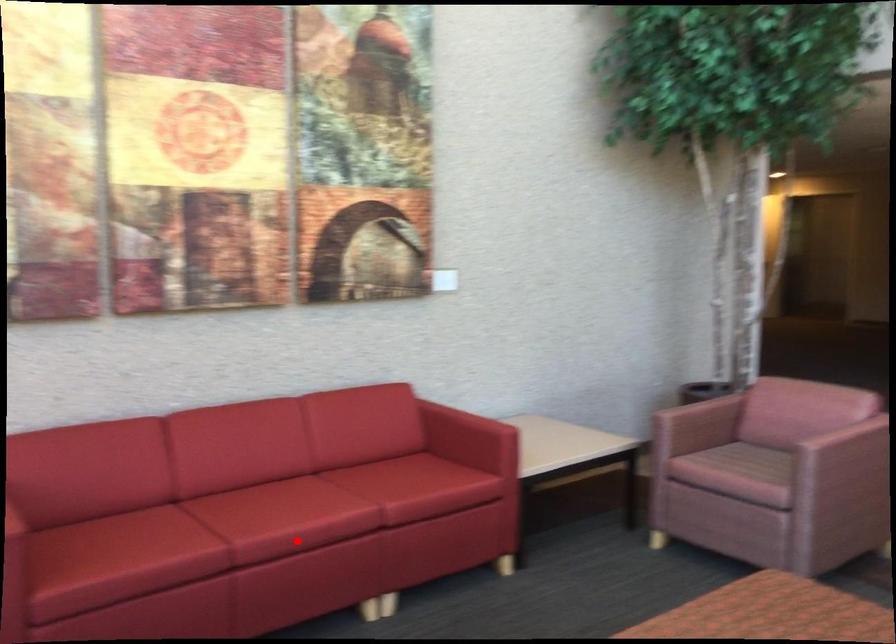
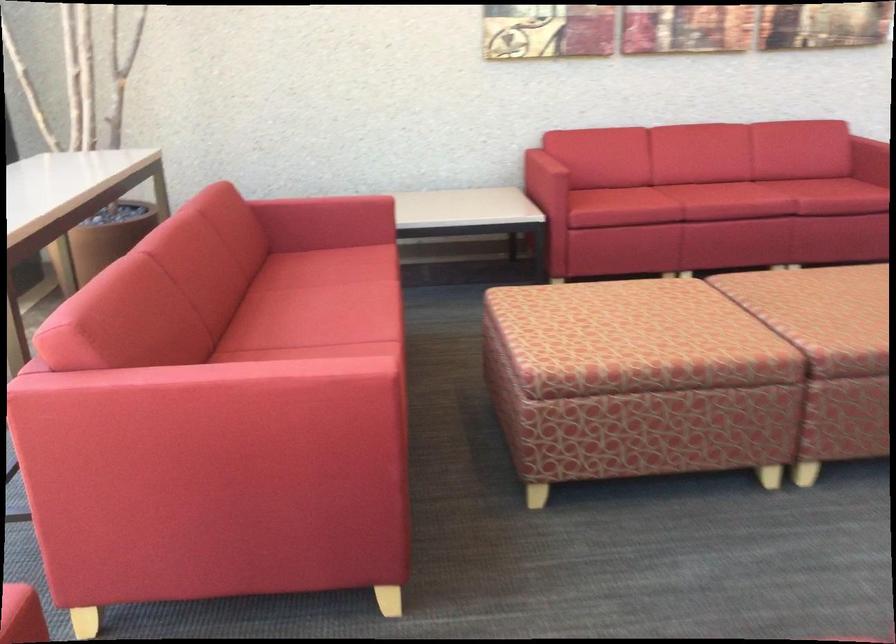
Where in the second image is the point corresponding to the highlighted location from the first image?

(725, 201)